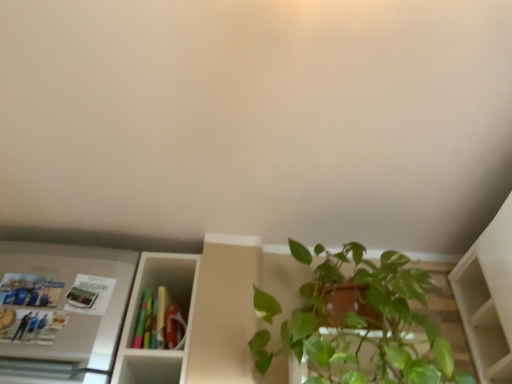
Question: Based on their sizes in the image, would you say green glossy plant at lower right is bigger or smaller than matte plastic book at center?

Choices:
 (A) big
 (B) small

Answer: (A)

Question: From a real-world perspective, is green glossy plant at lower right positioned above or below matte plastic book at center?

Choices:
 (A) above
 (B) below

Answer: (B)

Question: Which is nearer to the matte plastic book at center?

Choices:
 (A) green glossy plant at lower right
 (B) metallic silver fridge at left

Answer: (B)

Question: Which of these objects is positioned closest to the green glossy plant at lower right?

Choices:
 (A) metallic silver fridge at left
 (B) matte plastic book at center

Answer: (B)